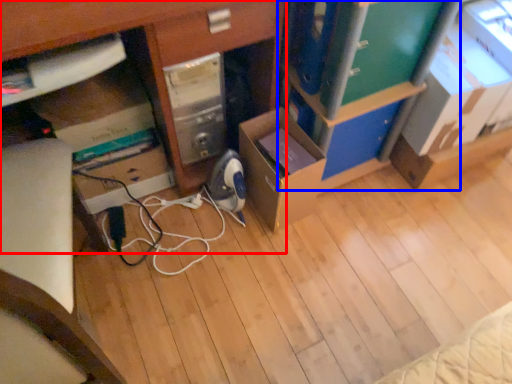
Question: Which of the following is the closest to the observer, desk (highlighted by a red box) or bookshelf (highlighted by a blue box)?

Choices:
 (A) desk
 (B) bookshelf

Answer: (A)